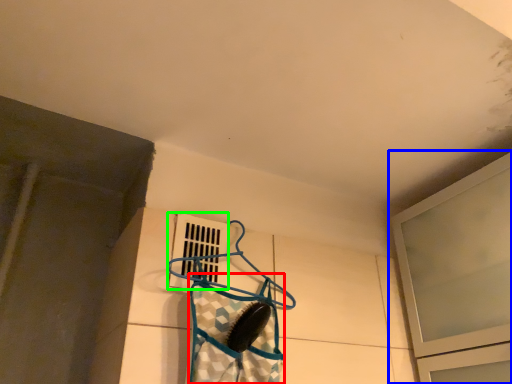
Question: Which object is the closest to the clothing (highlighted by a red box)? Choose among these: window (highlighted by a blue box) or window (highlighted by a green box).

Choices:
 (A) window
 (B) window

Answer: (B)